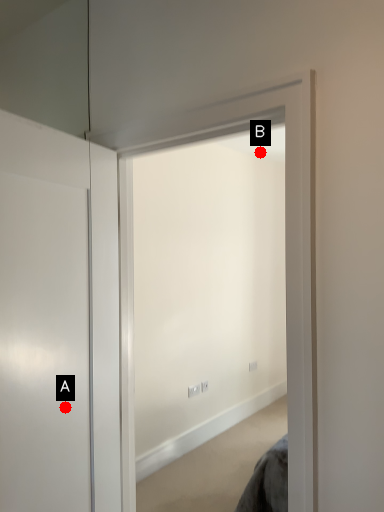
Question: Two points are circled on the image, labeled by A and B beside each circle. Which point is closer to the camera?

Choices:
 (A) A is closer
 (B) B is closer

Answer: (A)